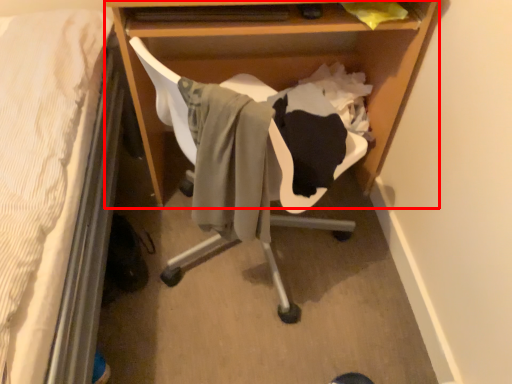
Question: Considering the relative positions of desk (annotated by the red box) and swivel chair in the image provided, where is desk (annotated by the red box) located with respect to the staircase?

Choices:
 (A) left
 (B) right

Answer: (B)